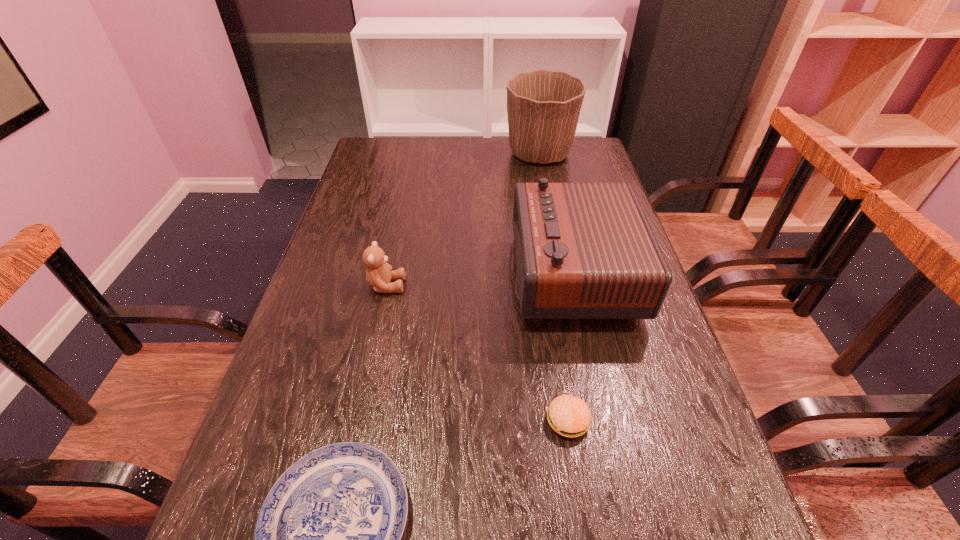
Image resolution: width=960 pixels, height=540 pixels. Find the location of `flowerpot`. flowerpot is located at coordinates (543, 106).

Find the location of a particular element. This screenshot has width=960, height=540. the farthest object is located at coordinates (543, 106).

Identify the location of radio receiver. The width and height of the screenshot is (960, 540). (583, 250).

Locate an element on the screen. the third tallest object is located at coordinates coord(378,274).

What are the coordinates of `the fourth tallest object` in the screenshot? It's located at (568, 415).

Find the location of `patty`. patty is located at coordinates (568, 415).

This screenshot has width=960, height=540. Identify the location of vacant space located on the front of the flowerpot. (555, 232).

Where is `free region located on the front panel of the radio receiver`? free region located on the front panel of the radio receiver is located at coordinates (375, 273).

This screenshot has height=540, width=960. I want to click on free space located on the front panel of the radio receiver, so click(451, 273).

I want to click on vacant space located 0.160m on the front panel of the radio receiver, so click(x=451, y=273).